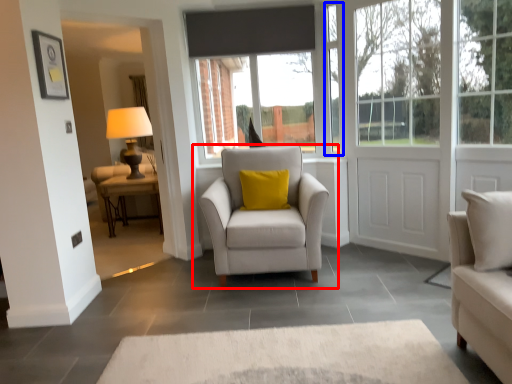
Question: Which object is closer to the camera taking this photo, chair (highlighted by a red box) or window frame (highlighted by a blue box)?

Choices:
 (A) chair
 (B) window frame

Answer: (A)